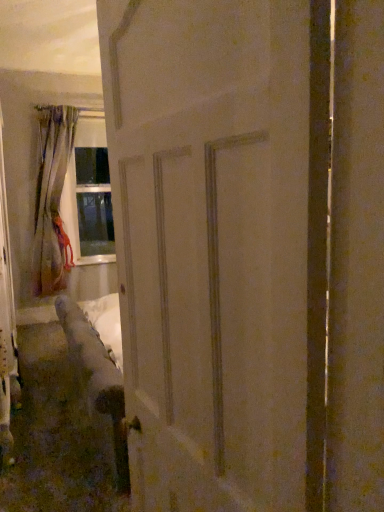
Question: From the image's perspective, is white matte door at center positioned above or below beige fabric curtain at left?

Choices:
 (A) below
 (B) above

Answer: (A)

Question: Is white matte door at center wider or thinner than beige fabric curtain at left?

Choices:
 (A) thin
 (B) wide

Answer: (A)

Question: In terms of height, does white matte door at center look taller or shorter compared to beige fabric curtain at left?

Choices:
 (A) short
 (B) tall

Answer: (A)

Question: Considering the positions of beige fabric curtain at left and white matte door at center in the image, is beige fabric curtain at left wider or thinner than white matte door at center?

Choices:
 (A) thin
 (B) wide

Answer: (B)

Question: From the image's perspective, is beige fabric curtain at left located above or below white matte door at center?

Choices:
 (A) above
 (B) below

Answer: (A)

Question: Is beige fabric curtain at left bigger or smaller than white matte door at center?

Choices:
 (A) big
 (B) small

Answer: (A)

Question: Considering the positions of point (62, 142) and point (145, 53), is point (62, 142) closer or farther from the camera than point (145, 53)?

Choices:
 (A) closer
 (B) farther

Answer: (B)